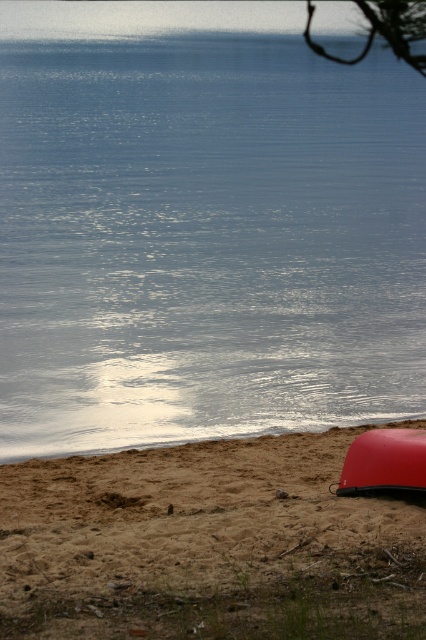
You are standing on the sandy beach and want to reach the shiny red canoe at lower right. Which direction should you walk to get there from the glistening blue water at lower center?

You should walk to the right from the glistening blue water at lower center to reach the shiny red canoe at lower right since the water is positioned to the left of the canoe.

You are standing at the edge of the lake and want to know the exact coordinates of the glistening blue water at lower center. What are its coordinates?

The glistening blue water at lower center is located at coordinates point (x=203, y=227).

You are standing on the sandy beach in the foreground of the lakeside scene. You want to find the glistening blue water at lower center. Based on the coordinates provided, in which direction should you walk from your current position to reach it?

The glistening blue water at lower center is located at point coordinates, so you should walk towards the lower center direction from your current position on the sandy beach to reach it.